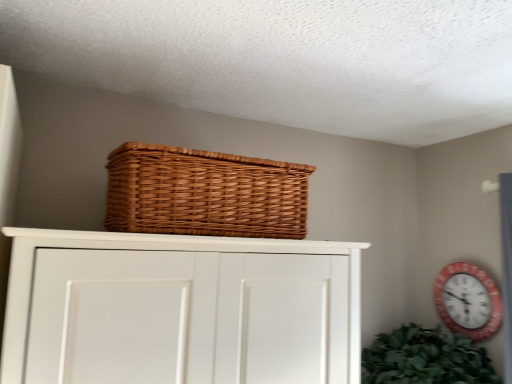
Question: Is woven brown basket at upper center wider or thinner than red plastic wall clock at upper right?

Choices:
 (A) thin
 (B) wide

Answer: (B)

Question: From the image's perspective, is woven brown basket at upper center above or below red plastic wall clock at upper right?

Choices:
 (A) below
 (B) above

Answer: (B)

Question: Visually, is woven brown basket at upper center positioned to the left or to the right of red plastic wall clock at upper right?

Choices:
 (A) right
 (B) left

Answer: (B)

Question: In the image, is red plastic wall clock at upper right positioned in front of or behind woven brown basket at upper center?

Choices:
 (A) behind
 (B) front

Answer: (A)

Question: Would you say red plastic wall clock at upper right is to the left or to the right of woven brown basket at upper center in the picture?

Choices:
 (A) right
 (B) left

Answer: (A)

Question: Choose the correct answer: Is red plastic wall clock at upper right inside woven brown basket at upper center or outside it?

Choices:
 (A) inside
 (B) outside

Answer: (B)

Question: Considering the positions of point (481, 309) and point (198, 157), is point (481, 309) closer or farther from the camera than point (198, 157)?

Choices:
 (A) farther
 (B) closer

Answer: (A)